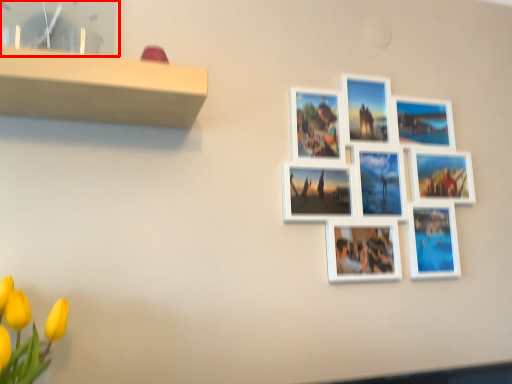
Question: From the image's perspective, what is the correct spatial relationship of picture frame (annotated by the red box) in relation to picture frame?

Choices:
 (A) above
 (B) below

Answer: (A)